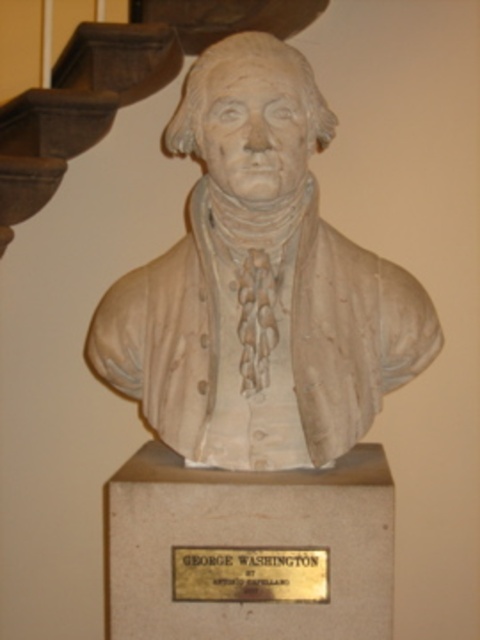
Does white marble bust at center have a greater width compared to gold metallic plaque at center?

Indeed, white marble bust at center has a greater width compared to gold metallic plaque at center.

Is white marble bust at center shorter than gold metallic plaque at center?

No.

The width and height of the screenshot is (480, 640). What do you see at coordinates (260, 284) in the screenshot?
I see `white marble bust at center` at bounding box center [260, 284].

The height and width of the screenshot is (640, 480). Identify the location of white marble bust at center. (260, 284).

This screenshot has height=640, width=480. What are the coordinates of `white marble bust at center` in the screenshot? It's located at (x=260, y=284).

Is white marble bust at center above dark brown wood at upper left?

No.

This screenshot has height=640, width=480. Identify the location of white marble bust at center. (260, 284).

Locate an element on the screen. white marble bust at center is located at coordinates (260, 284).

Does dark brown wood at upper left have a lesser width compared to gold metallic plaque at center?

No.

This screenshot has width=480, height=640. What do you see at coordinates (75, 108) in the screenshot? I see `dark brown wood at upper left` at bounding box center [75, 108].

At what (x,y) coordinates should I click in order to perform the action: click on dark brown wood at upper left. Please return your answer as a coordinate pair (x, y). The height and width of the screenshot is (640, 480). Looking at the image, I should click on (75, 108).

Identify the location of dark brown wood at upper left. This screenshot has height=640, width=480. (75, 108).